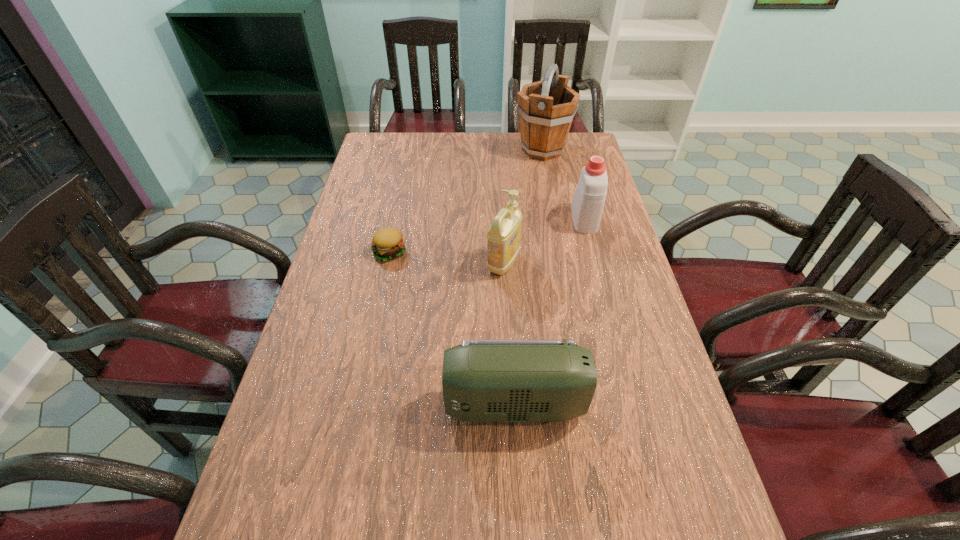
Locate an element on the screen. The width and height of the screenshot is (960, 540). the tallest object is located at coordinates (546, 108).

Identify the location of the farthest object. The image size is (960, 540). (546, 108).

Image resolution: width=960 pixels, height=540 pixels. What are the coordinates of `the right detergent` in the screenshot? It's located at (588, 200).

The height and width of the screenshot is (540, 960). In order to click on the farther detergent in this screenshot , I will do `click(588, 200)`.

This screenshot has width=960, height=540. What are the coordinates of `the nearer detergent` in the screenshot? It's located at (503, 236).

Image resolution: width=960 pixels, height=540 pixels. Find the location of `the nearest object`. the nearest object is located at coordinates (483, 380).

At what (x,y) coordinates should I click in order to perform the action: click on the second shortest object. Please return your answer as a coordinate pair (x, y). The height and width of the screenshot is (540, 960). Looking at the image, I should click on (483, 380).

Locate an element on the screen. The height and width of the screenshot is (540, 960). the shortest object is located at coordinates (387, 243).

Find the location of a particular element. This screenshot has height=540, width=960. hamburger is located at coordinates (387, 243).

This screenshot has width=960, height=540. I want to click on free space located 0.260m on the left of the farthest object, so click(x=447, y=150).